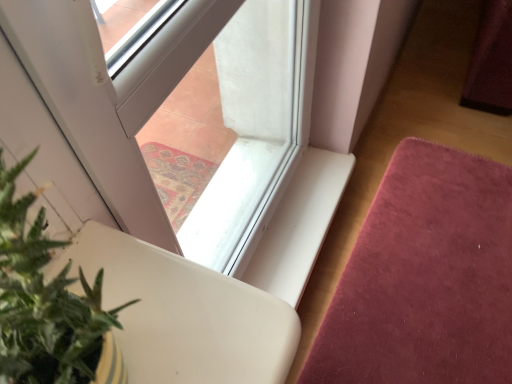
The image size is (512, 384). What do you see at coordinates (425, 277) in the screenshot? I see `velvet pink mat at lower right` at bounding box center [425, 277].

Identify the location of green leafy plant at lower left. (47, 303).

Locate an element on the screen. This screenshot has height=384, width=512. transparent glass window at center is located at coordinates (166, 97).

The height and width of the screenshot is (384, 512). What are the coordinates of `velvet pink mat at lower right` in the screenshot? It's located at (425, 277).

Is green leafy plant at lower left next to transparent glass window at center?

green leafy plant at lower left is not next to transparent glass window at center, and they're not touching.

Locate an element on the screen. The image size is (512, 384). window below the green leafy plant at lower left (from a real-world perspective) is located at coordinates (166, 97).

Is green leafy plant at lower left wider than transparent glass window at center?

Indeed, green leafy plant at lower left has a greater width compared to transparent glass window at center.

Considering the relative positions of green leafy plant at lower left and transparent glass window at center in the image provided, is green leafy plant at lower left to the left of transparent glass window at center from the viewer's perspective?

Indeed, green leafy plant at lower left is positioned on the left side of transparent glass window at center.

From the image's perspective, is velvet pink mat at lower right on green leafy plant at lower left?

Actually, velvet pink mat at lower right appears below green leafy plant at lower left in the image.

Which object is more forward, velvet pink mat at lower right or green leafy plant at lower left?

green leafy plant at lower left is closer to the camera.

Can you confirm if green leafy plant at lower left is bigger than velvet pink mat at lower right?

Actually, green leafy plant at lower left might be smaller than velvet pink mat at lower right.

Locate an element on the screen. The height and width of the screenshot is (384, 512). mat to the right of green leafy plant at lower left is located at coordinates (425, 277).

From the picture: Which object is wider, green leafy plant at lower left or velvet pink mat at lower right?

Wider between the two is velvet pink mat at lower right.

In the image, is velvet pink mat at lower right on the left side or the right side of transparent glass window at center?

From the image, it's evident that velvet pink mat at lower right is to the right of transparent glass window at center.

Which point is more distant from viewer, [458,256] or [230,169]?

The point [230,169] is more distant.

Can you confirm if velvet pink mat at lower right is smaller than transparent glass window at center?

Actually, velvet pink mat at lower right might be larger than transparent glass window at center.

From the image's perspective, which object appears higher, velvet pink mat at lower right or transparent glass window at center?

transparent glass window at center appears higher in the image.

Considering the sizes of objects transparent glass window at center and green leafy plant at lower left in the image provided, who is thinner, transparent glass window at center or green leafy plant at lower left?

transparent glass window at center is thinner.

Is transparent glass window at center facing away from green leafy plant at lower left?

No.

Consider the image. Considering the relative positions of transparent glass window at center and green leafy plant at lower left in the image provided, is transparent glass window at center to the left of green leafy plant at lower left from the viewer's perspective?

In fact, transparent glass window at center is to the right of green leafy plant at lower left.

Is transparent glass window at center facing towards velvet pink mat at lower right?

Yes, transparent glass window at center is aimed at velvet pink mat at lower right.

Is transparent glass window at center in contact with velvet pink mat at lower right?

They are not placed beside each other.

From the image's perspective, which is below, transparent glass window at center or velvet pink mat at lower right?

velvet pink mat at lower right.

Find the location of a particular element. window below the green leafy plant at lower left (from a real-world perspective) is located at coordinates (166, 97).

Find the location of a particular element. The width and height of the screenshot is (512, 384). houseplant above the velvet pink mat at lower right (from a real-world perspective) is located at coordinates (47, 303).

From the image, which object appears to be farther from transparent glass window at center, green leafy plant at lower left or velvet pink mat at lower right?

green leafy plant at lower left lies further to transparent glass window at center than the other object.

Looking at this image, considering their positions, is transparent glass window at center positioned closer to velvet pink mat at lower right than green leafy plant at lower left?

transparent glass window at center.

Based on their spatial positions, is transparent glass window at center or velvet pink mat at lower right further from green leafy plant at lower left?

transparent glass window at center is positioned further to the anchor green leafy plant at lower left.

When comparing their distances from green leafy plant at lower left, does velvet pink mat at lower right or transparent glass window at center seem closer?

Among the two, velvet pink mat at lower right is located nearer to green leafy plant at lower left.

From the image, which object appears to be nearer to transparent glass window at center, velvet pink mat at lower right or green leafy plant at lower left?

The object closer to transparent glass window at center is velvet pink mat at lower right.

From the image, which object appears to be farther from velvet pink mat at lower right, green leafy plant at lower left or transparent glass window at center?

The object further to velvet pink mat at lower right is green leafy plant at lower left.

Identify the location of window situated between green leafy plant at lower left and velvet pink mat at lower right from left to right. (166, 97).